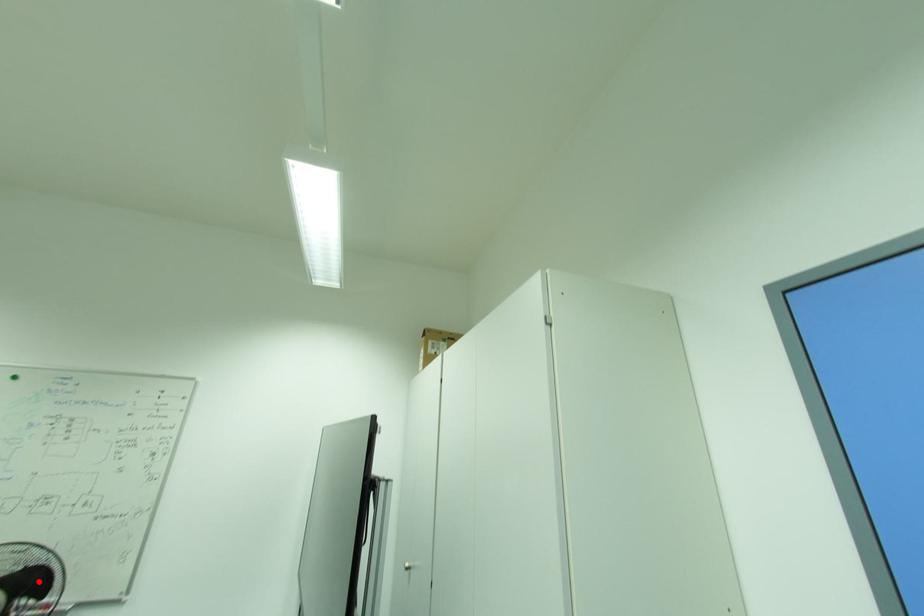
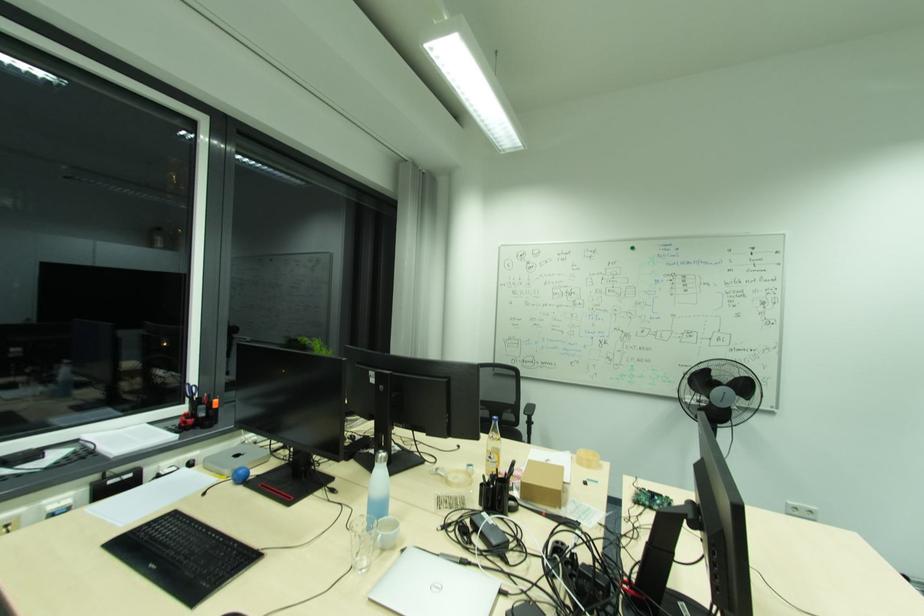
In the second image, find the point that corresponds to the highlighted location in the first image.

(748, 387)